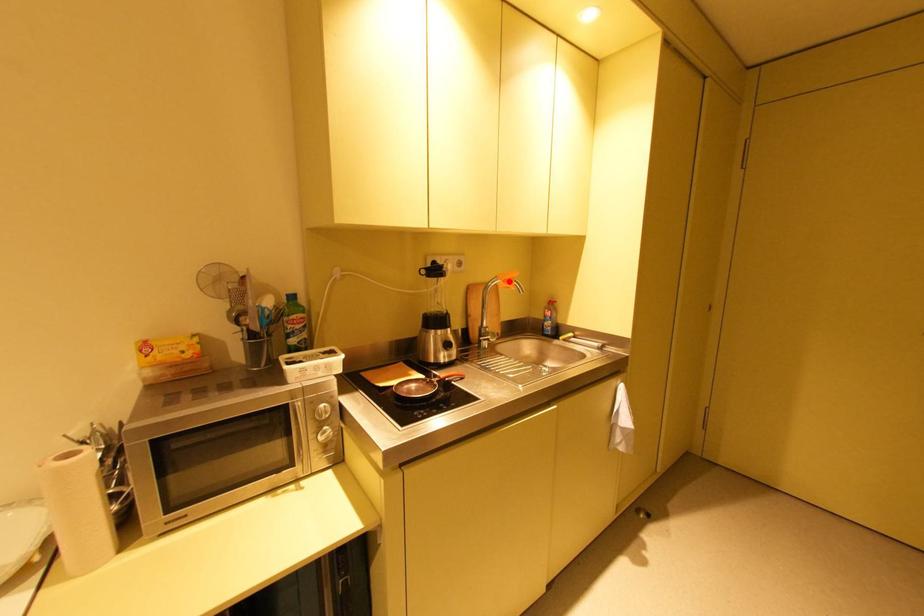
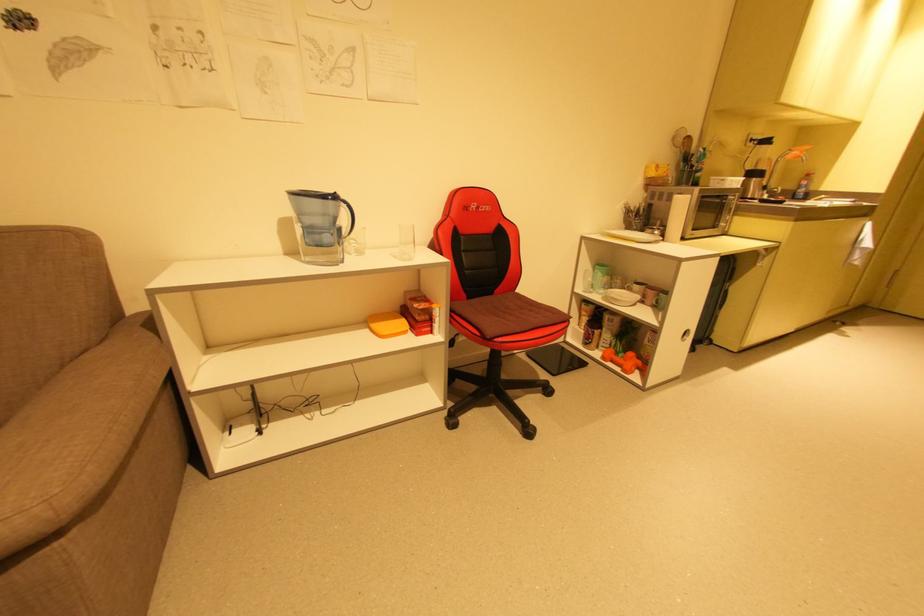
Where in the second image is the point corresponding to the highlighted location from the first image?

(805, 152)